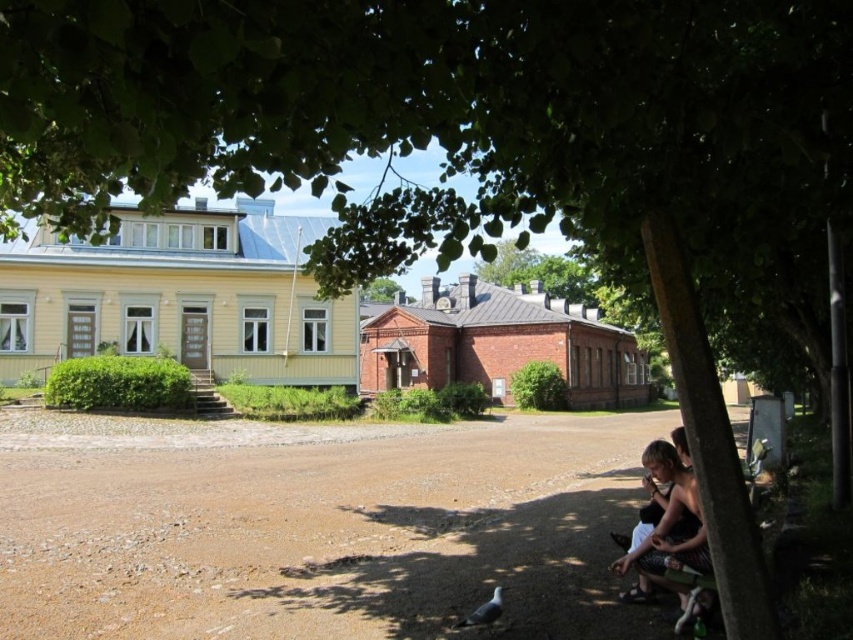
In the scene shown: Which is above, green leafy tree at upper center or green leafy tree at center?

green leafy tree at center is above.

Measure the distance between point (x=503, y=36) and camera.

Point (x=503, y=36) and camera are 3.62 meters apart from each other.

Where is `green leafy tree at upper center`? Image resolution: width=853 pixels, height=640 pixels. green leafy tree at upper center is located at coordinates (444, 120).